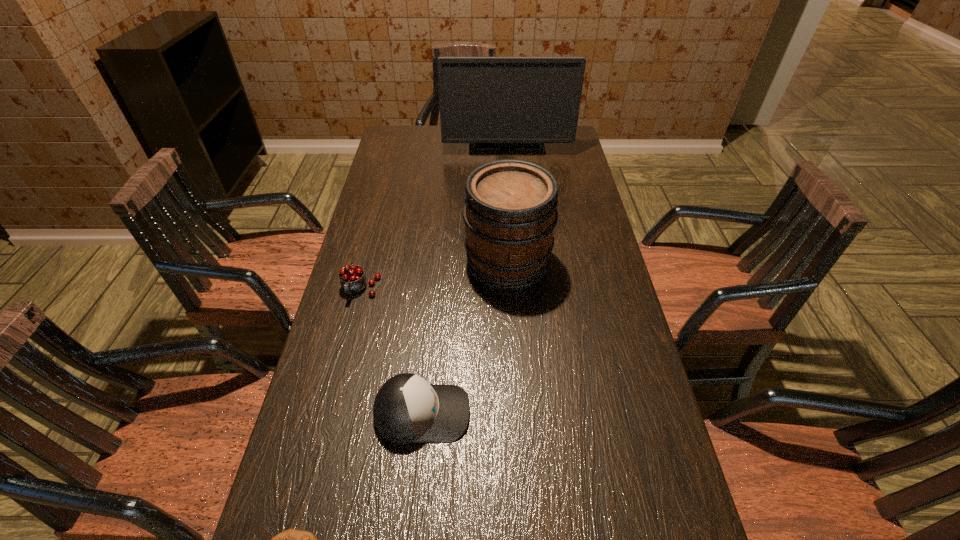
The image size is (960, 540). Identify the location of the tallest object. (485, 101).

I want to click on computer monitor, so click(485, 101).

Find the location of a particular element. The width and height of the screenshot is (960, 540). the fourth shortest object is located at coordinates (510, 212).

Locate an element on the screen. This screenshot has height=540, width=960. cherry is located at coordinates (352, 278).

I want to click on cap, so click(407, 409).

Find the location of a particular element. vacant space located on the screen side of the tallest object is located at coordinates (510, 178).

I want to click on vacant area located on the back of the fourth shortest object, so click(x=502, y=174).

Locate an element on the screen. This screenshot has width=960, height=540. blank space located on the handle side of the cherry is located at coordinates (346, 348).

Find the location of a particular element. The width and height of the screenshot is (960, 540). free spot located on the front panel of the fourth farthest object is located at coordinates click(638, 413).

The width and height of the screenshot is (960, 540). Identify the location of object that is at the far edge. (485, 101).